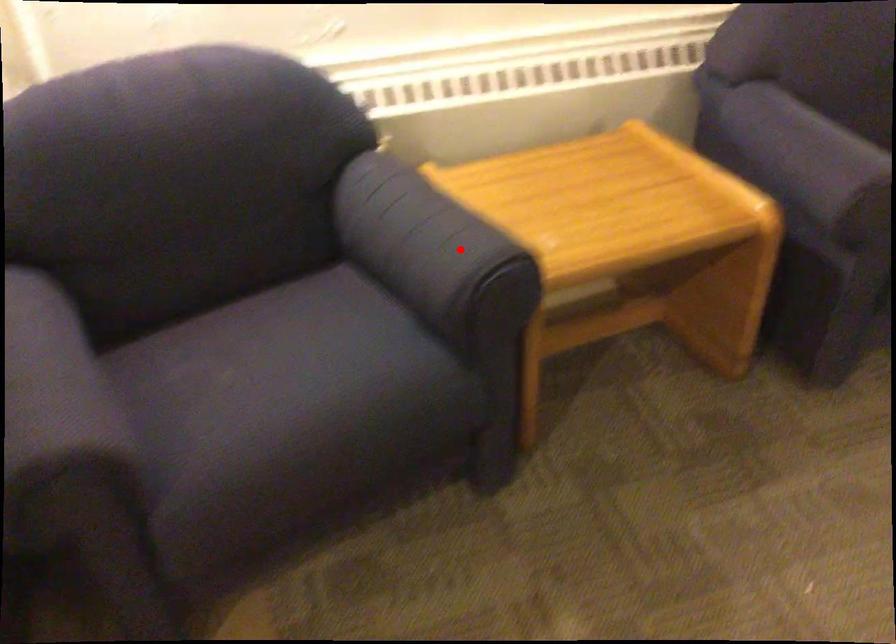
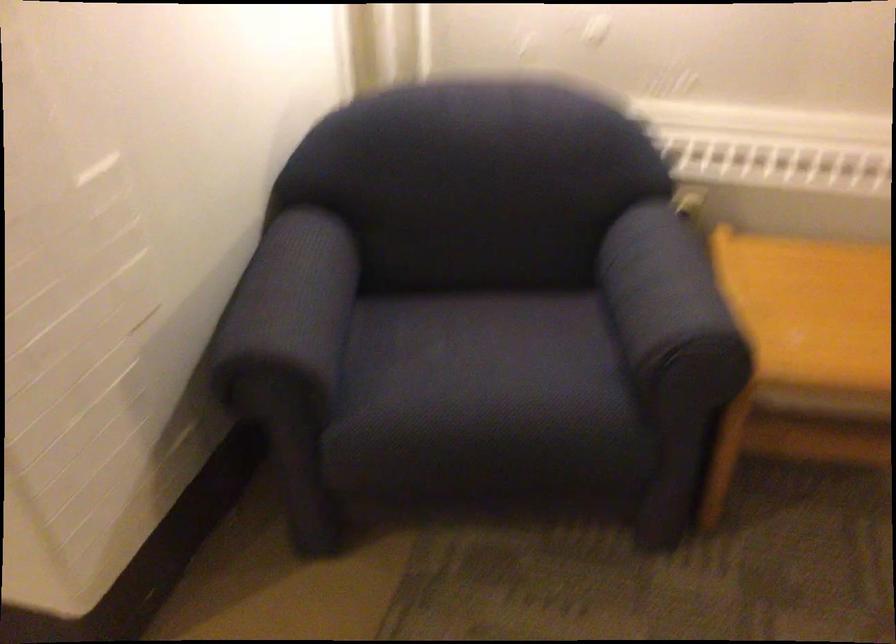
The point at the highlighted location is marked in the first image. Where is the corresponding point in the second image?

(670, 307)